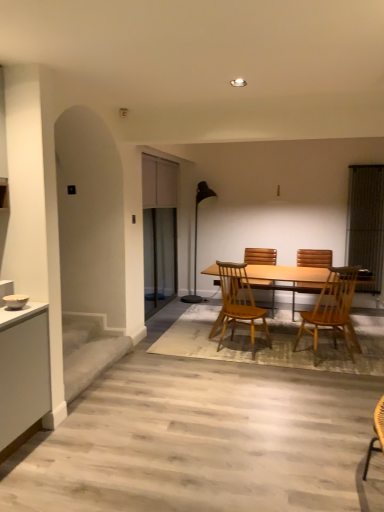
Find the location of `free spot to the right of light brown wooden chair at center, which ranks as the 3th chair in back-to-front order`. free spot to the right of light brown wooden chair at center, which ranks as the 3th chair in back-to-front order is located at coordinates (284, 354).